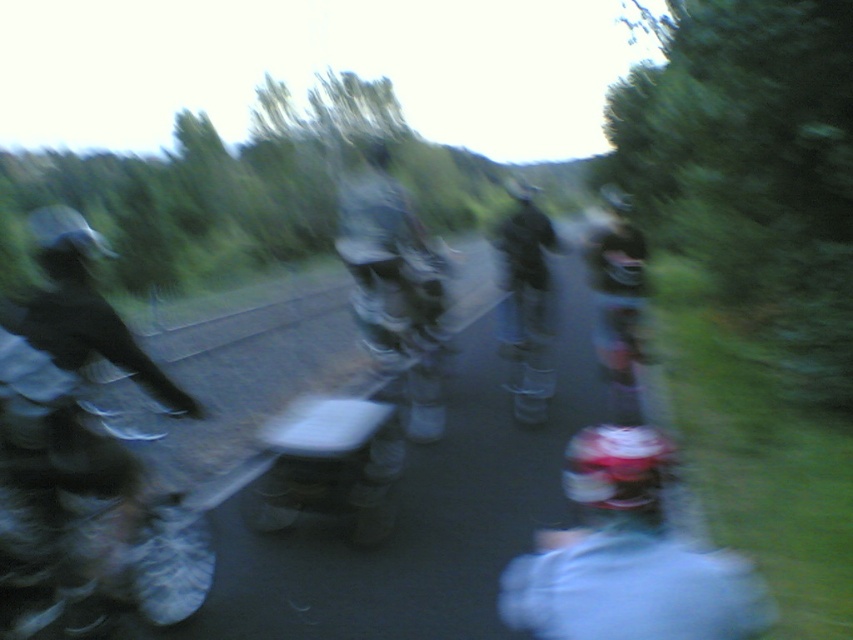
In the scene shown: Can you confirm if metallic silver motorcycle at left is thinner than white matte helmet at center?

Yes, metallic silver motorcycle at left is thinner than white matte helmet at center.

Between metallic silver motorcycle at left and white matte helmet at center, which one is positioned higher?

metallic silver motorcycle at left

The image size is (853, 640). Identify the location of metallic silver motorcycle at left. (50, 493).